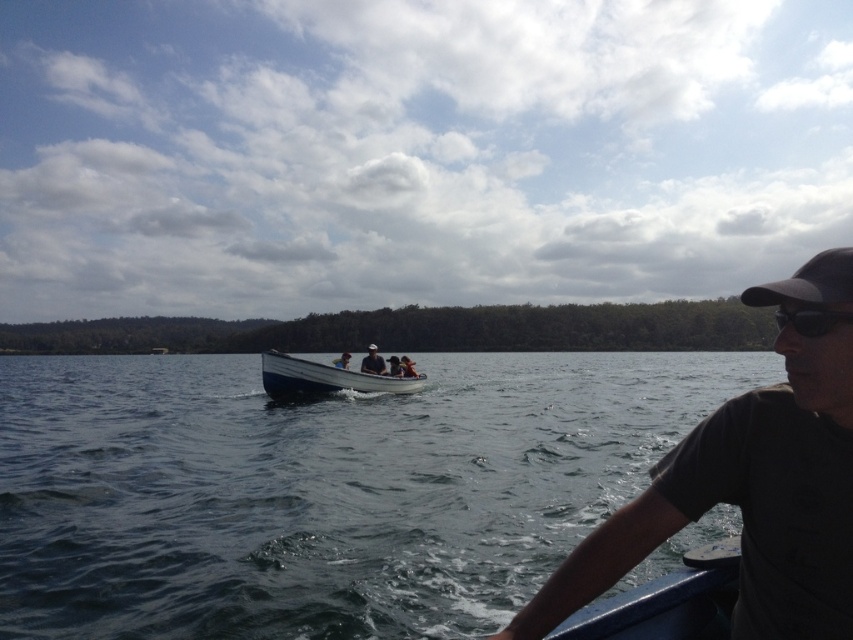
You are a photographer trying to capture a clear shot of the black plastic goggles at right located at point (811, 320). However, there is a man in the foreground wearing a dark cap and sunglasses. Will the man block your view of the goggles?

The man in the foreground is partially visible from the side and extends his arm towards the water, but since the black plastic goggles at right are located at point (811, 320), which is likely positioned to the right side of the image, the man is not blocking the view of the goggles as he is in the foreground on the other side.

You are standing on the motorboat and looking at two points in the water. The first point is at coordinates point (x=180, y=381) and the second point is at coordinates point (x=367, y=376). Which point is closer to you?

Point (x=180, y=381) is closer to you because it is further to the viewer than point (x=367, y=376).